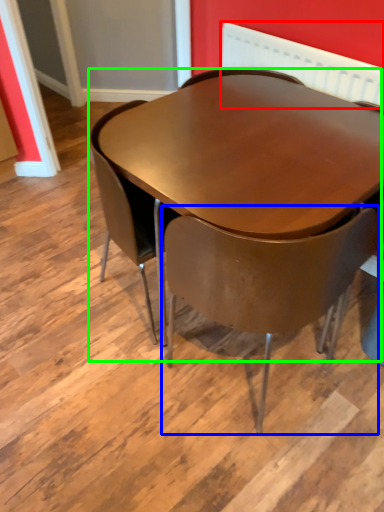
Question: Which object is the closest to the radiator (highlighted by a red box)? Choose among these: chair (highlighted by a blue box) or table (highlighted by a green box).

Choices:
 (A) chair
 (B) table

Answer: (B)